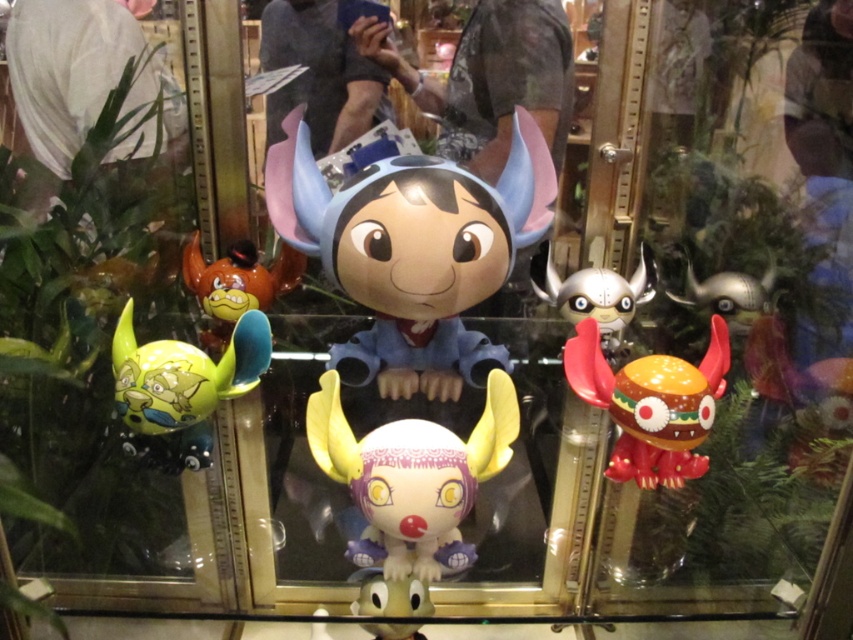
Question: Among these objects, which one is farthest from the camera?

Choices:
 (A) bright red plastic toy at right
 (B) white matte plush toy at center
 (C) matte plastic figurine at center
 (D) silver metallic helmet at center

Answer: (D)

Question: Observing the image, what is the correct spatial positioning of white matte plush toy at center in reference to silver metallic helmet at center?

Choices:
 (A) above
 (B) below

Answer: (B)

Question: Which point is farther to the camera?

Choices:
 (A) pos(165,390)
 (B) pos(660,467)
 (C) pos(440,500)

Answer: (B)

Question: Which of the following is the farthest from the observer?

Choices:
 (A) matte plastic figurine at center
 (B) shiny yellow toy at left

Answer: (A)

Question: Can you confirm if bright red plastic toy at right is thinner than shiny yellow toy at left?

Choices:
 (A) yes
 (B) no

Answer: (B)

Question: Is white matte plush toy at center to the left of bright red plastic toy at right from the viewer's perspective?

Choices:
 (A) no
 (B) yes

Answer: (B)